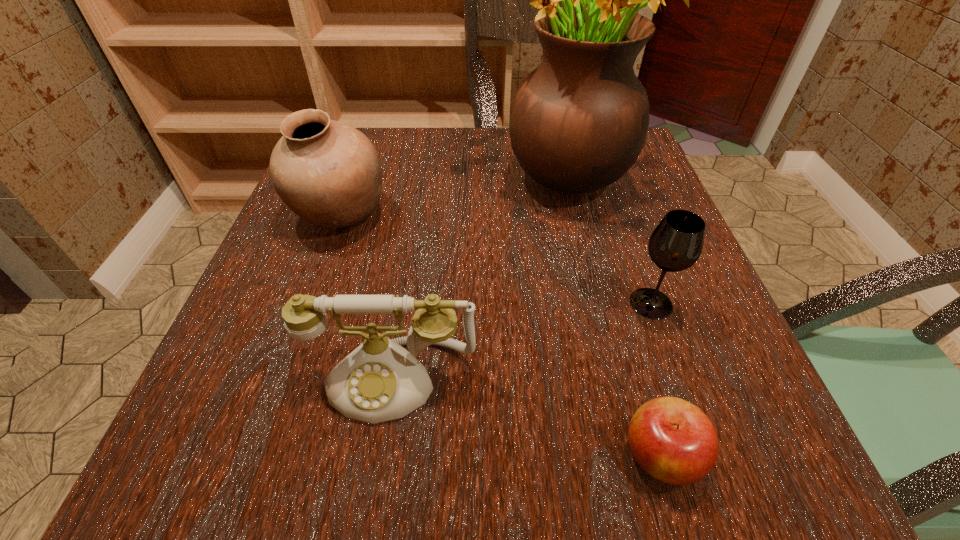
Locate an element on the screen. This screenshot has width=960, height=540. object that is at the far edge is located at coordinates (579, 121).

Image resolution: width=960 pixels, height=540 pixels. What are the coordinates of `object that is positioned at the near edge` in the screenshot? It's located at (674, 441).

You are a GUI agent. You are given a task and a screenshot of the screen. Output one action in this format:
    pyautogui.click(x=<x>, y=<y>)
    Task: Click on the pottery present at the left edge
    Image resolution: width=960 pixels, height=540 pixels.
    Given the screenshot: What is the action you would take?
    pyautogui.click(x=327, y=172)

Locate an element on the screen. telephone located at the left edge is located at coordinates (379, 381).

Where is `flower arrangement that is at the right edge`? flower arrangement that is at the right edge is located at coordinates (579, 121).

Identify the location of wineglass that is at the right edge. (676, 243).

Identify the location of apple that is at the right edge. (674, 441).

Identify the location of object located at the far right corner. The height and width of the screenshot is (540, 960). (579, 121).

Where is `object located at the near right corner`? object located at the near right corner is located at coordinates (674, 441).

This screenshot has width=960, height=540. What are the coordinates of `blank space at the far edge of the desktop` in the screenshot? It's located at click(396, 145).